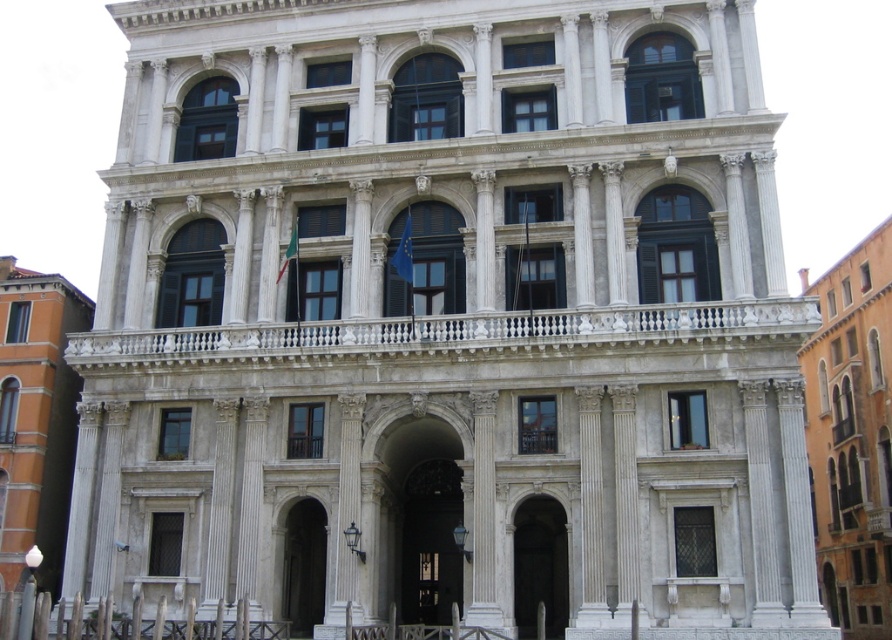
What are the coordinates of `dark wood door at center` in the screenshot? It's located at (431, 541).

Does orange stucco building at right have a greater width compared to dark wood door at center?

Yes.

Does orange stucco building at right have a lesser height compared to dark wood door at center?

No, orange stucco building at right is not shorter than dark wood door at center.

What are the coordinates of `orange stucco building at right` in the screenshot? It's located at (851, 435).

Who is higher up, orange stucco building at right or orange brick building at left?

orange stucco building at right

Does orange stucco building at right have a lesser height compared to orange brick building at left?

No.

Between point (847, 404) and point (60, 369), which one is positioned in front?

Point (60, 369) is more forward.

Find the location of a particular element. This screenshot has height=640, width=892. orange stucco building at right is located at coordinates (851, 435).